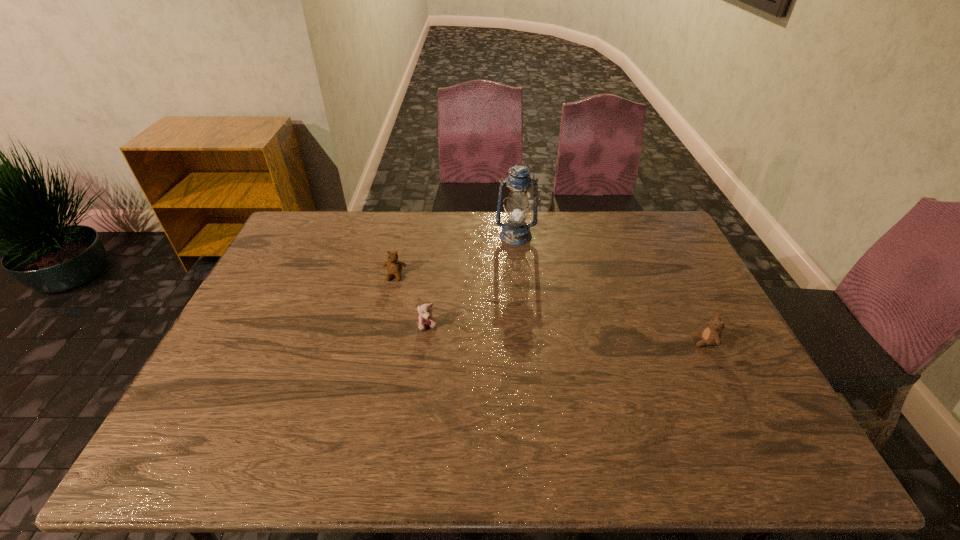
I want to click on vacant space located on the front-facing side of the farthest teddy bear, so click(x=372, y=376).

At what (x,y) coordinates should I click in order to perform the action: click on vacant region located 0.320m at the face of the second teddy bear from right to left. Please return your answer as a coordinate pair (x, y). The image size is (960, 540). Looking at the image, I should click on (415, 440).

Identify the location of object at the far edge. The width and height of the screenshot is (960, 540). (514, 232).

Where is `object that is at the right edge`? The image size is (960, 540). object that is at the right edge is located at coordinates (711, 335).

Where is `vacant point at the far edge`? vacant point at the far edge is located at coordinates (462, 240).

Where is `vacant area at the near edge`? This screenshot has height=540, width=960. vacant area at the near edge is located at coordinates (530, 442).

The image size is (960, 540). I want to click on vacant space at the left edge of the desktop, so click(276, 326).

At what (x,y) coordinates should I click in order to perform the action: click on free region at the right edge. Please return your answer as a coordinate pair (x, y). The width and height of the screenshot is (960, 540). Looking at the image, I should click on (681, 334).

This screenshot has width=960, height=540. What are the coordinates of `vacant space at the far right corner of the desktop` in the screenshot? It's located at (672, 231).

Where is `empty location between the second object from right to left and the second teddy bear from right to left`? empty location between the second object from right to left and the second teddy bear from right to left is located at coordinates (472, 281).